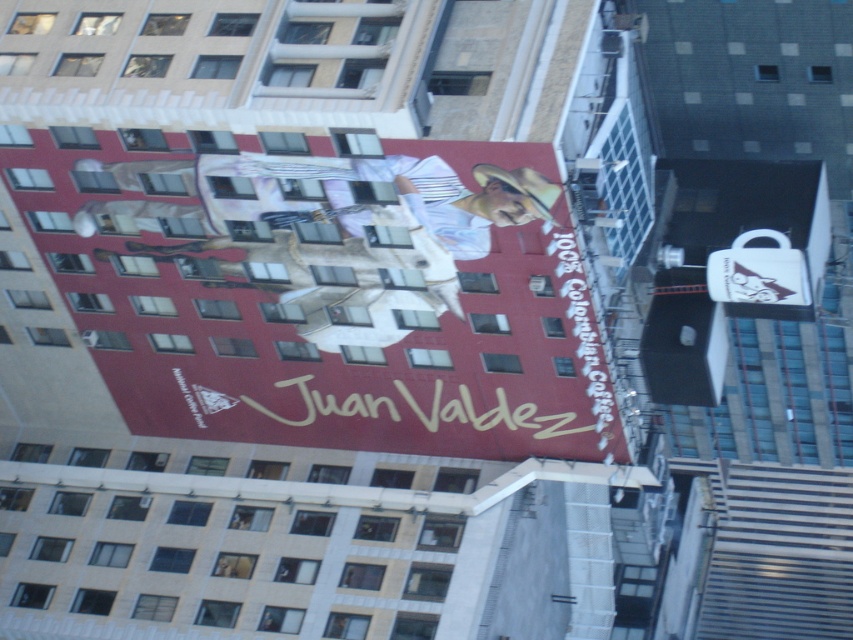
Question: Which object appears farthest from the camera in this image?

Choices:
 (A) matte red billboard at upper center
 (B) white matte text at upper center

Answer: (B)

Question: Is matte red billboard at upper center positioned at the back of white matte text at upper center?

Choices:
 (A) yes
 (B) no

Answer: (B)

Question: Does matte red billboard at upper center have a lesser width compared to white matte text at upper center?

Choices:
 (A) no
 (B) yes

Answer: (A)

Question: Can you confirm if matte red billboard at upper center is positioned to the left of white matte text at upper center?

Choices:
 (A) yes
 (B) no

Answer: (A)